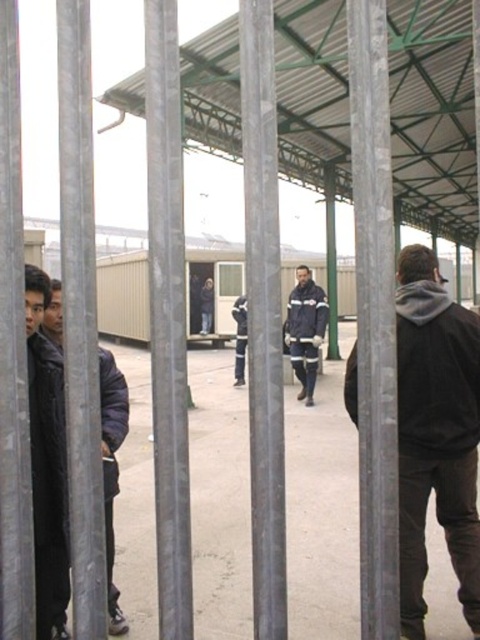
Question: Is dark blue jacket at left thinner than dark blue fabric jacket at center?

Choices:
 (A) yes
 (B) no

Answer: (A)

Question: Which of the following is the farthest from the observer?

Choices:
 (A) dark blue fabric jacket at center
 (B) dark blue jacket at left

Answer: (A)

Question: Does dark gray hoodie at right have a lesser width compared to dark blue jacket at left?

Choices:
 (A) yes
 (B) no

Answer: (B)

Question: Is dark gray hoodie at right positioned behind dark blue fabric jacket at center?

Choices:
 (A) yes
 (B) no

Answer: (B)

Question: Which object is positioned farthest from the dark blue fabric jacket at center?

Choices:
 (A) dark gray hoodie at right
 (B) dark blue jacket at left

Answer: (B)

Question: Which of the following is the farthest from the observer?

Choices:
 (A) (300, 378)
 (B) (116, 465)
 (C) (478, 621)

Answer: (A)